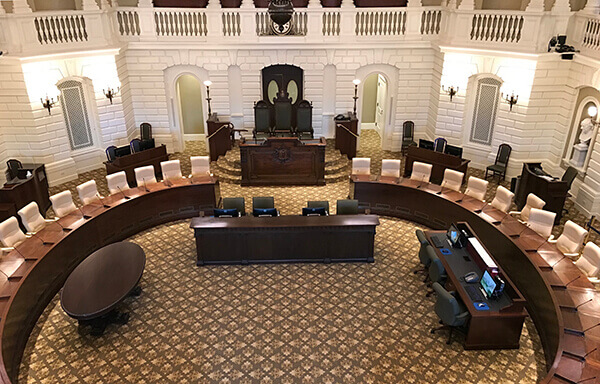
This screenshot has width=600, height=384. What are the coordinates of `fancy chair in middle` in the screenshot? It's located at (285, 112).